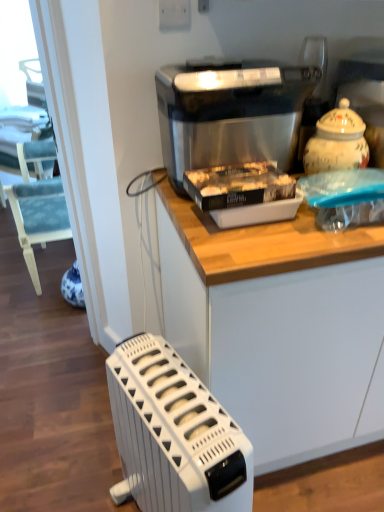
Image resolution: width=384 pixels, height=512 pixels. In order to click on blank space situated above white plastic radiator at lower left (from a real-world perspective) in this screenshot , I will do `click(172, 398)`.